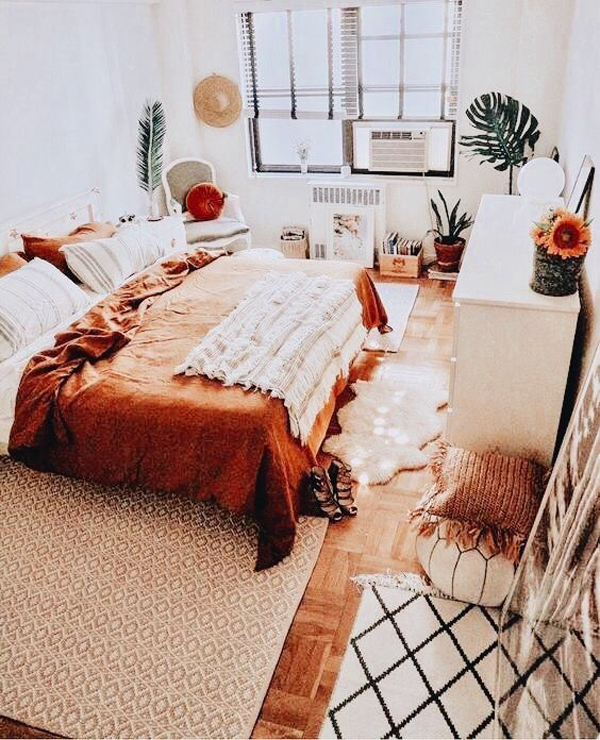
You are a GUI agent. You are given a task and a screenshot of the screen. Output one action in this format:
    pyautogui.click(x=<x>, y=<y>)
    Task: Click on the brown pillow
    
    Given the screenshot: What is the action you would take?
    pyautogui.click(x=493, y=499)